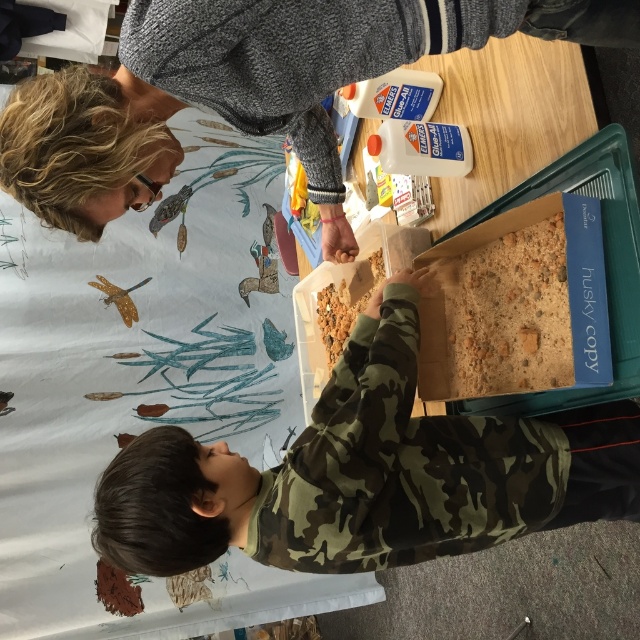
Question: Which of the following is the closest to the observer?

Choices:
 (A) camouflage fabric at center
 (B) camouflage sweater at center
 (C) brown crumbly food at center
 (D) brown crumbly soil at center

Answer: (B)

Question: Does camouflage sweater at center have a larger size compared to brown crumbly food at center?

Choices:
 (A) no
 (B) yes

Answer: (B)

Question: Which of the following is the farthest from the observer?

Choices:
 (A) brown crumbly soil at center
 (B) camouflage fabric at center
 (C) brown crumbly food at center

Answer: (C)

Question: Can you confirm if camouflage fabric at center is positioned to the right of brown crumbly food at center?

Choices:
 (A) no
 (B) yes

Answer: (B)

Question: From the image, what is the correct spatial relationship of camouflage fabric at center in relation to camouflage sweater at center?

Choices:
 (A) left
 (B) right

Answer: (B)

Question: Which point appears closest to the camera in this image?

Choices:
 (A) (339, 326)
 (B) (310, 0)

Answer: (B)